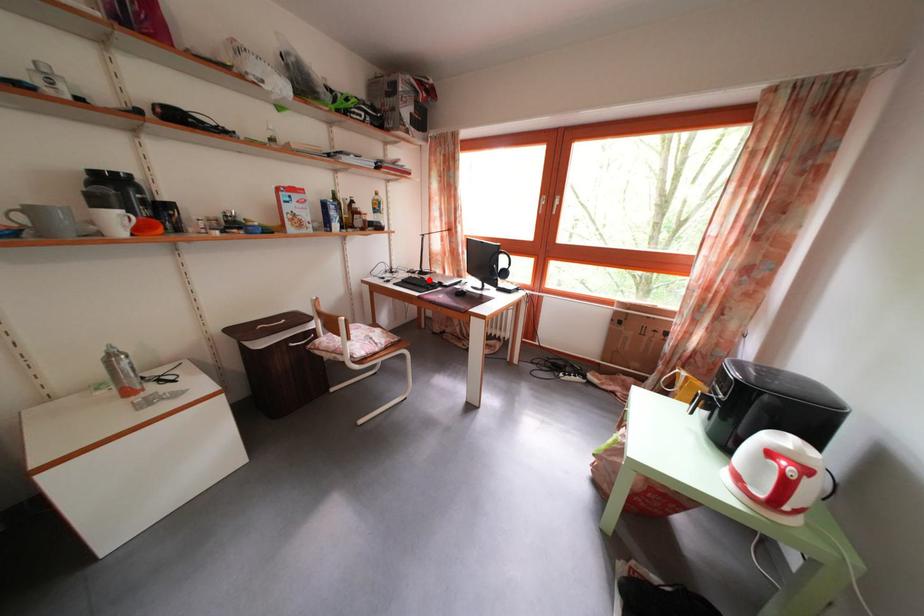
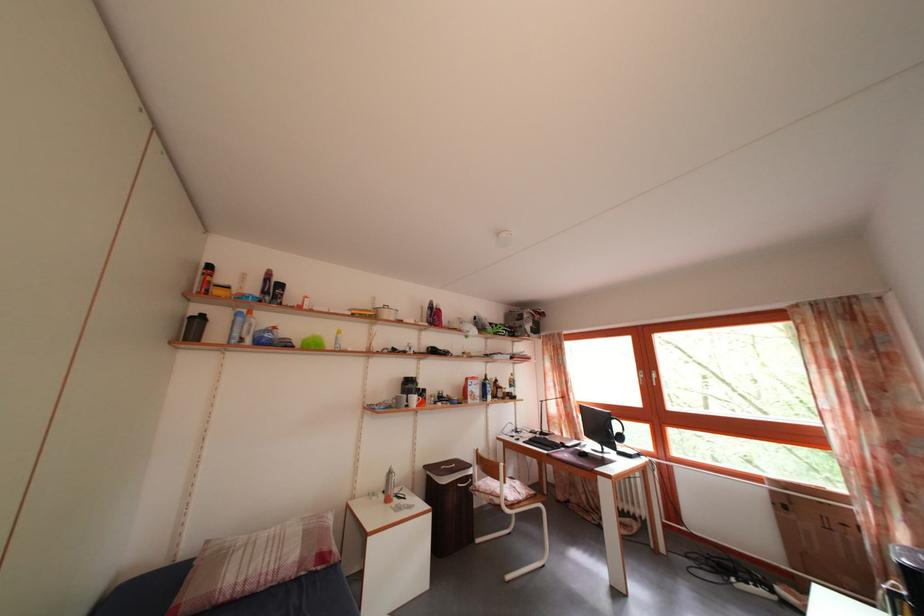
The point at the highlighted location is marked in the first image. Where is the corresponding point in the second image?

(550, 440)